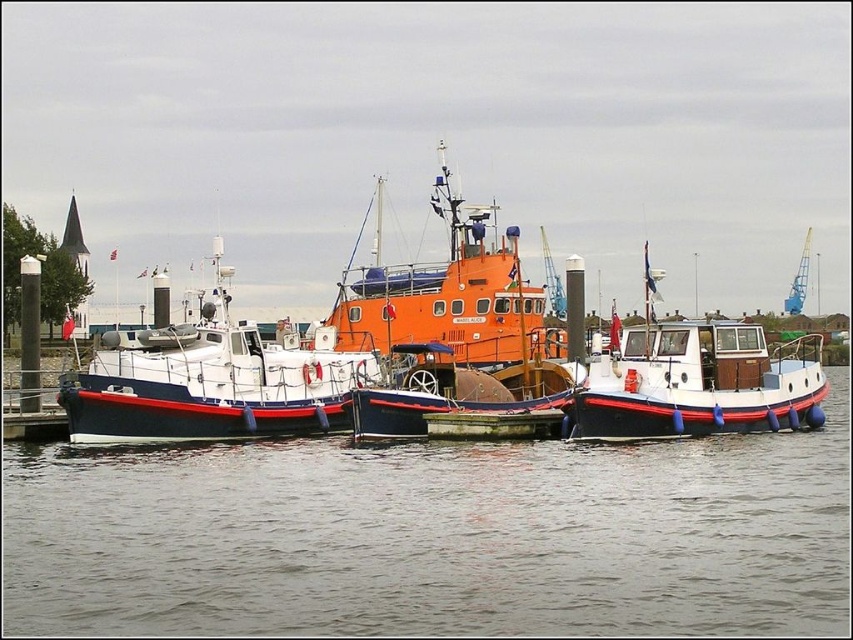
Question: Is smooth water at center thinner than orange matte tugboat at center?

Choices:
 (A) no
 (B) yes

Answer: (A)

Question: Is smooth water at center wider than orange matte tugboat at center?

Choices:
 (A) yes
 (B) no

Answer: (A)

Question: Which point appears farthest from the camera in this image?

Choices:
 (A) (157, 406)
 (B) (578, 499)
 (C) (581, 419)
 (D) (380, 285)

Answer: (D)

Question: Can you confirm if white matte boat at left is bigger than white matte boat at center?

Choices:
 (A) no
 (B) yes

Answer: (B)

Question: Which point is closer to the camera?

Choices:
 (A) smooth water at center
 (B) white matte boat at left
 (C) orange matte tugboat at center

Answer: (A)

Question: Which object appears farthest from the camera in this image?

Choices:
 (A) orange matte tugboat at center
 (B) white matte boat at center

Answer: (A)